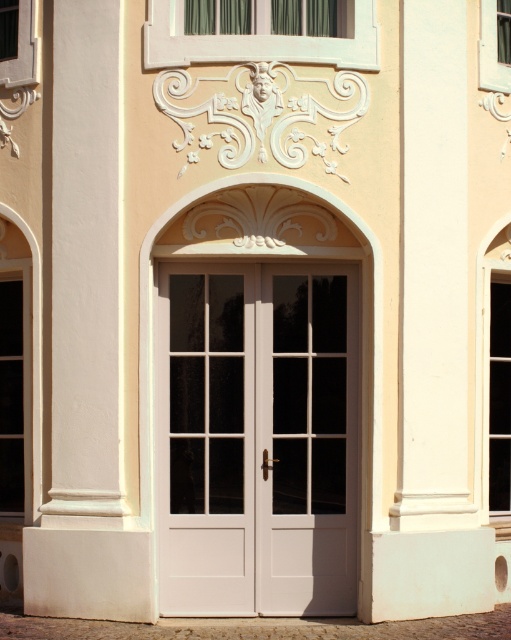
Question: Estimate the real-world distances between objects in this image. Which object is farther from the white smooth pillar at center?

Choices:
 (A) white wood door at center
 (B) white smooth pillar at right

Answer: (B)

Question: Among these objects, which one is nearest to the camera?

Choices:
 (A) white smooth pillar at center
 (B) white smooth pillar at right

Answer: (A)

Question: Is the position of white wood door at center more distant than that of white smooth pillar at right?

Choices:
 (A) no
 (B) yes

Answer: (B)

Question: Can you confirm if white wood door at center is wider than white smooth pillar at right?

Choices:
 (A) yes
 (B) no

Answer: (A)

Question: Which point is closer to the camera?

Choices:
 (A) white wood door at center
 (B) white smooth pillar at right

Answer: (B)

Question: Does white smooth pillar at center appear over white smooth pillar at right?

Choices:
 (A) no
 (B) yes

Answer: (B)